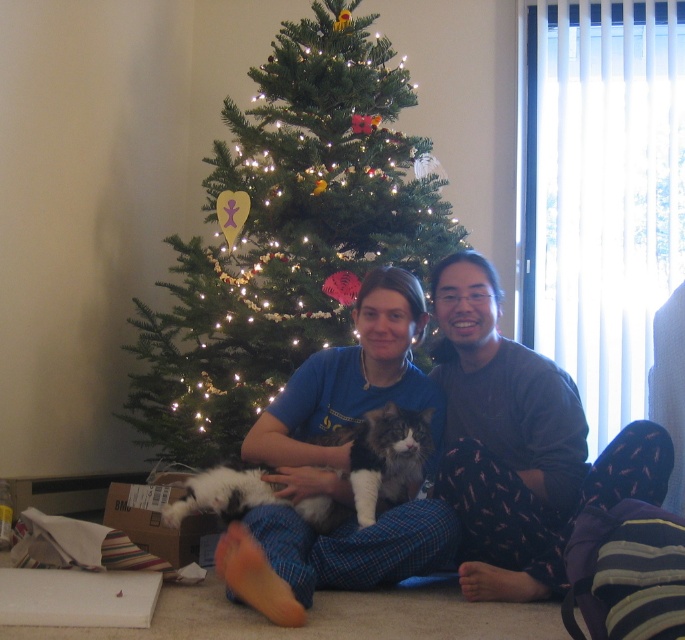
You are standing at the origin point in the image. You need to walk to the point labeled as point (340, 515). However, there is an obstacle at point (345, 444). Can you reach your destination without passing through the obstacle?

Since point (345, 444) is behind point (340, 515), you can reach the destination without passing through the obstacle because the obstacle is located behind the destination point.

You are a photographer trying to capture a clear shot of both the dark gray fleece pants at center and the blue cotton shirt at center. Which object is closer to the camera so that you can focus on it first?

The dark gray fleece pants at center is closer to the camera than the blue cotton shirt at center, so focusing on it first will ensure both are in focus.